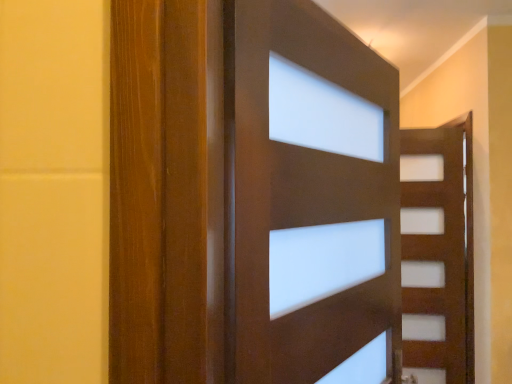
This screenshot has width=512, height=384. Describe the element at coordinates (271, 203) in the screenshot. I see `matte brown door at center` at that location.

You are a GUI agent. You are given a task and a screenshot of the screen. Output one action in this format:
    pyautogui.click(x=<x>, y=<y>)
    Task: Click on the matte brown door at center
    The height and width of the screenshot is (384, 512).
    Given the screenshot: What is the action you would take?
    pyautogui.click(x=271, y=203)

Locate an element on the screen. matte brown door at center is located at coordinates (271, 203).